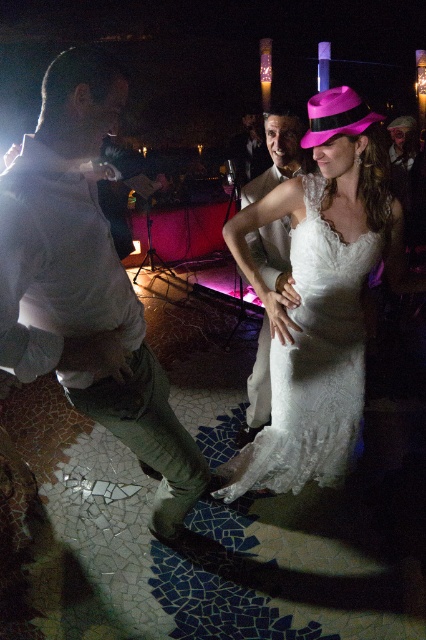
Question: Is white lace dress at center positioned at the back of matte white suit at center?

Choices:
 (A) yes
 (B) no

Answer: (B)

Question: Among these points, which one is farthest from the camera?

Choices:
 (A) (279, 220)
 (B) (123, 308)

Answer: (A)

Question: Which of the following is the closest to the observer?

Choices:
 (A) (314, 416)
 (B) (46, 339)
 (C) (278, 170)

Answer: (B)

Question: Considering the relative positions of white cotton shirt at left and white lace dress at center in the image provided, where is white cotton shirt at left located with respect to white lace dress at center?

Choices:
 (A) left
 (B) right

Answer: (A)

Question: Is white lace dress at center smaller than matte white suit at center?

Choices:
 (A) yes
 (B) no

Answer: (B)

Question: Estimate the real-world distances between objects in this image. Which object is farther from the white cotton shirt at left?

Choices:
 (A) matte white suit at center
 (B) white lace dress at center

Answer: (A)